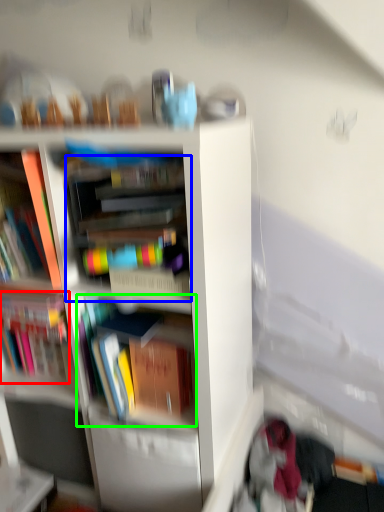
Question: Estimate the real-world distances between objects in this image. Which object is farther from book (highlighted by a red box), book (highlighted by a blue box) or book (highlighted by a green box)?

Choices:
 (A) book
 (B) book

Answer: (A)